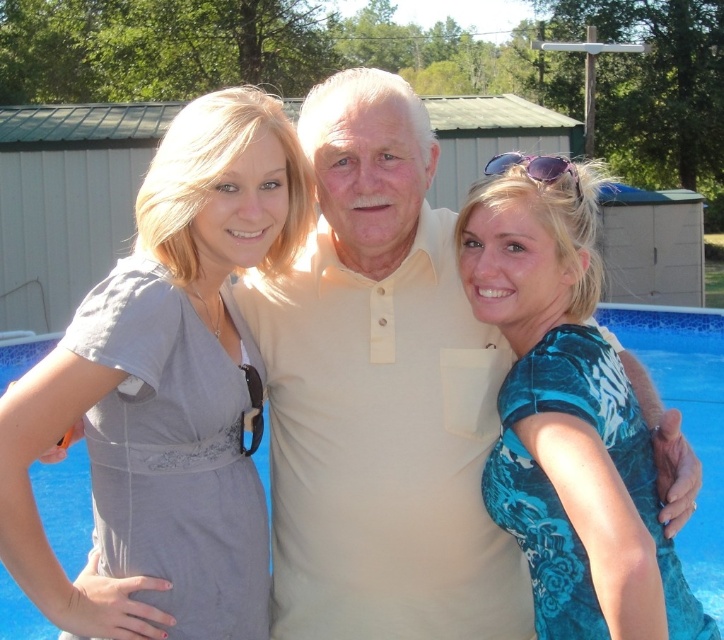
What do you see at coordinates (167, 385) in the screenshot? This screenshot has height=640, width=724. I see `gray fabric dress at left` at bounding box center [167, 385].

Looking at this image, is gray fabric dress at left bigger than blue floral dress at center?

Correct, gray fabric dress at left is larger in size than blue floral dress at center.

Is point (203, 288) less distant than point (544, 456)?

No, it is not.

Identify the location of gray fabric dress at left. (167, 385).